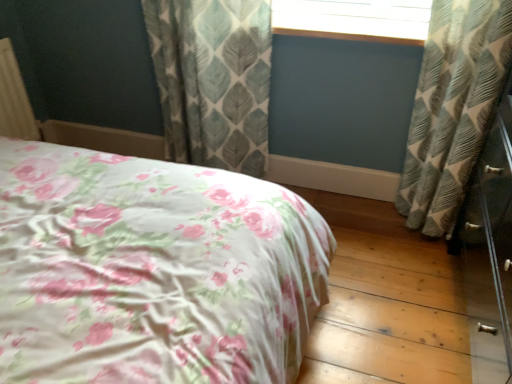
Question: Is textured gray-green leaf-patterned curtain at center, which is the first curtain from left to right, to the left of wooden window frame at upper center from the viewer's perspective?

Choices:
 (A) no
 (B) yes

Answer: (B)

Question: Is textured gray-green leaf-patterned curtain at center, which is the first curtain from left to right, bigger than wooden window frame at upper center?

Choices:
 (A) no
 (B) yes

Answer: (B)

Question: Is wooden window frame at upper center inside textured gray-green leaf-patterned curtain at center, which is the first curtain from left to right?

Choices:
 (A) yes
 (B) no

Answer: (B)

Question: From the image's perspective, is textured gray-green leaf-patterned curtain at center, positioned as the 2th curtain in right-to-left order, below wooden window frame at upper center?

Choices:
 (A) no
 (B) yes

Answer: (B)

Question: From a real-world perspective, is textured gray-green leaf-patterned curtain at center, positioned as the 2th curtain in right-to-left order, physically below wooden window frame at upper center?

Choices:
 (A) yes
 (B) no

Answer: (A)

Question: Is textured gray-green leaf-patterned curtain at center, which is the first curtain from left to right, with wooden window frame at upper center?

Choices:
 (A) yes
 (B) no

Answer: (B)

Question: Can you confirm if textured gray-green leaf-patterned curtain at center, which is the first curtain from left to right, is wider than floral fabric bed at center?

Choices:
 (A) no
 (B) yes

Answer: (A)

Question: Is textured gray-green leaf-patterned curtain at center, positioned as the 2th curtain in right-to-left order, next to floral fabric bed at center?

Choices:
 (A) yes
 (B) no

Answer: (B)

Question: Considering the relative positions of textured gray-green leaf-patterned curtain at center, positioned as the 2th curtain in right-to-left order, and floral fabric bed at center in the image provided, is textured gray-green leaf-patterned curtain at center, positioned as the 2th curtain in right-to-left order, in front of floral fabric bed at center?

Choices:
 (A) no
 (B) yes

Answer: (A)

Question: Can we say textured gray-green leaf-patterned curtain at center, positioned as the 2th curtain in right-to-left order, lies outside floral fabric bed at center?

Choices:
 (A) yes
 (B) no

Answer: (A)

Question: Is textured gray-green leaf-patterned curtain at center, which is the first curtain from left to right, bigger than floral fabric bed at center?

Choices:
 (A) no
 (B) yes

Answer: (A)

Question: Considering the relative sizes of textured gray-green leaf-patterned curtain at center, which is the first curtain from left to right, and floral fabric bed at center in the image provided, is textured gray-green leaf-patterned curtain at center, which is the first curtain from left to right, smaller than floral fabric bed at center?

Choices:
 (A) no
 (B) yes

Answer: (B)

Question: Does textured gray-green leaf-patterned curtain at center, which is the first curtain from left to right, lie in front of textured gray-green curtain at right, arranged as the first curtain when viewed from the right?

Choices:
 (A) yes
 (B) no

Answer: (B)